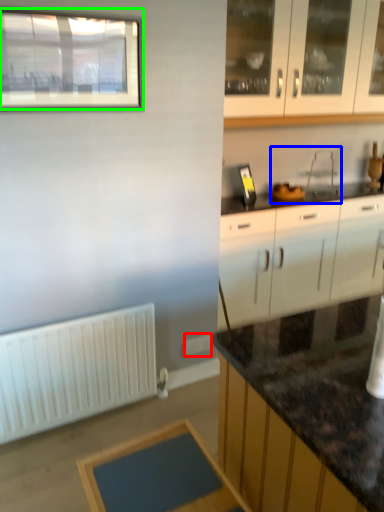
Question: Which object is positioned closest to electric outlet (highlighted by a red box)? Select from sink (highlighted by a blue box) and window (highlighted by a green box).

Choices:
 (A) sink
 (B) window

Answer: (A)